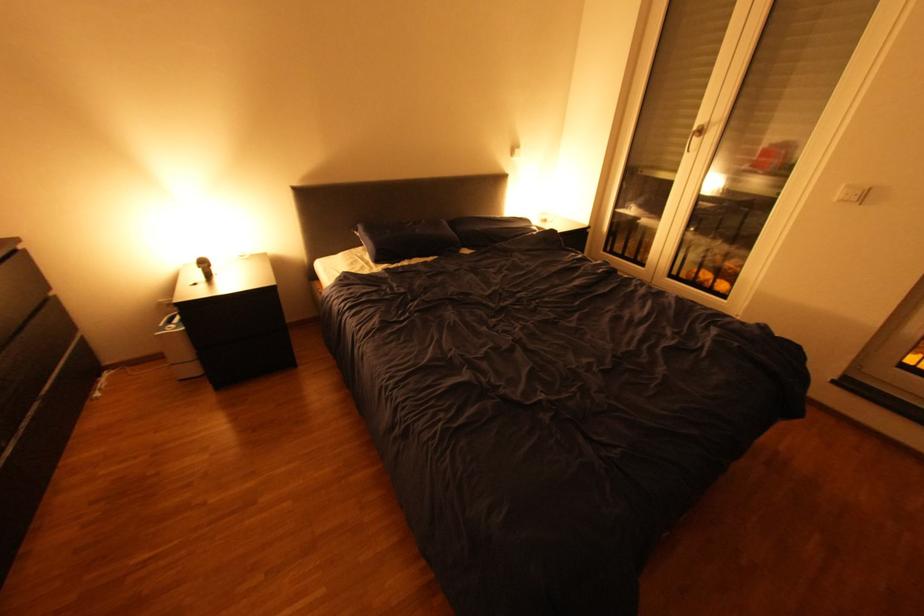
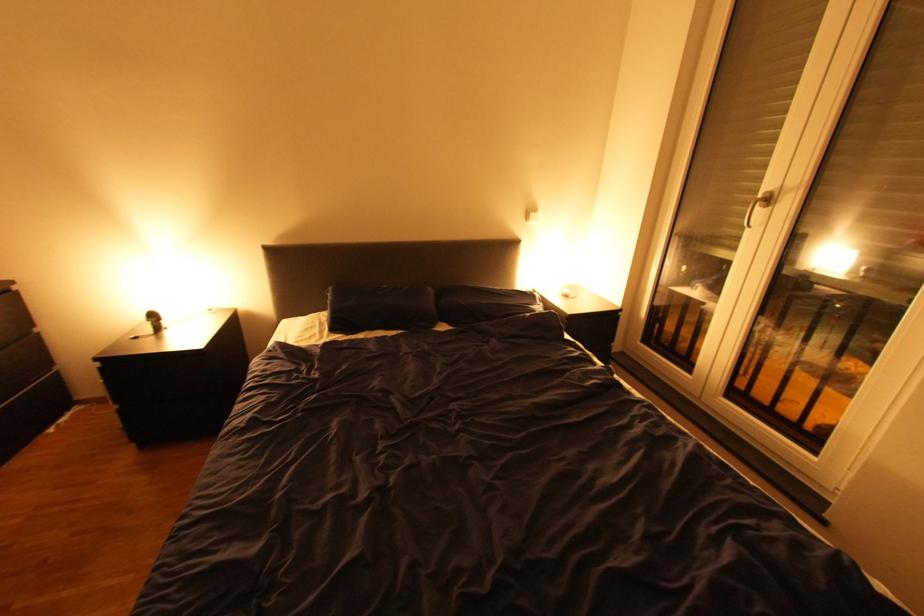
Looking at this image, the images are taken continuously from a first-person perspective. In which direction are you moving?

The movement direction of the cameraman is right, forward.